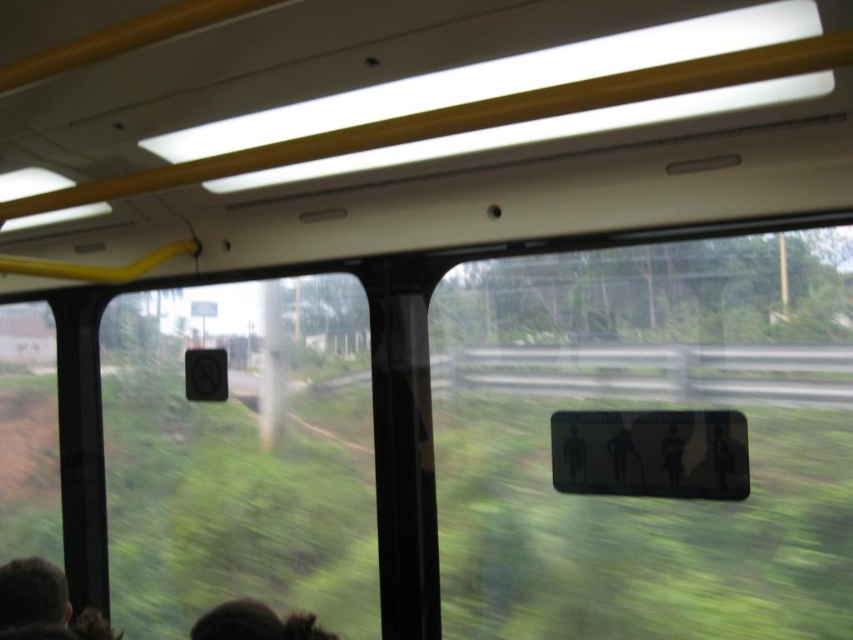
Question: Does transparent plastic sign at center lie in front of dark brown hair at lower left?

Choices:
 (A) no
 (B) yes

Answer: (A)

Question: Which object appears farthest from the camera in this image?

Choices:
 (A) transparent plastic sign at center
 (B) dark brown hair at lower left

Answer: (A)

Question: Considering the relative positions of transparent plastic sign at center and dark brown hair at lower left in the image provided, where is transparent plastic sign at center located with respect to dark brown hair at lower left?

Choices:
 (A) below
 (B) above

Answer: (B)

Question: Is transparent plastic sign at center thinner than dark brown hair at lower left?

Choices:
 (A) no
 (B) yes

Answer: (A)

Question: Which of the following is the closest to the observer?

Choices:
 (A) tap(460, 403)
 (B) tap(254, 602)

Answer: (B)